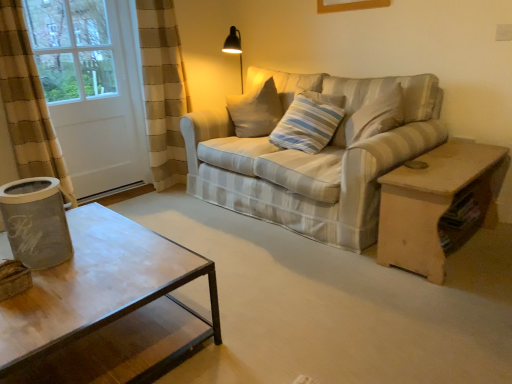
Find the location of a particular element. vacant area that is in front of striped fabric couch at center is located at coordinates (308, 293).